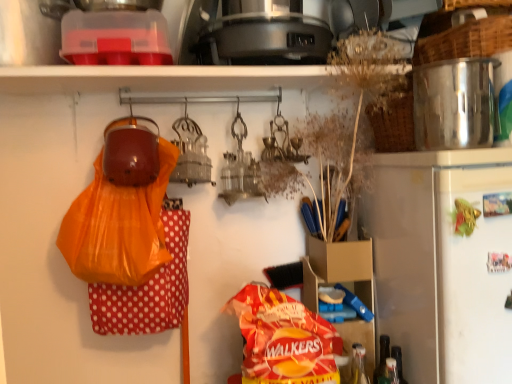
The image size is (512, 384). In order to click on satin silver refrigerator at right in this screenshot , I will do `click(442, 262)`.

This screenshot has height=384, width=512. What do you see at coordinates (466, 41) in the screenshot? I see `silver metallic pot at upper right` at bounding box center [466, 41].

I want to click on red matte bag of walkers chips at center, so click(x=283, y=339).

You are a GUI agent. You are given a task and a screenshot of the screen. Output one action in this format:
    pyautogui.click(x=<x>, y=<y>)
    Task: Click on the translucent plastic bottle at lower right, acting as the first bottle starting from the left
    
    Given the screenshot: What is the action you would take?
    pyautogui.click(x=358, y=365)

Is satin silver refrigerator at right smaller than shiny metallic pot at upper right?

No.

From the picture: Is satin silver refrigerator at right facing towards shiny metallic pot at upper right?

No, satin silver refrigerator at right is not aimed at shiny metallic pot at upper right.

Which object is wider, satin silver refrigerator at right or shiny metallic pot at upper right?

satin silver refrigerator at right is wider.

Based on the photo, considering their positions, is satin silver refrigerator at right located in front of or behind shiny metallic pot at upper right?

Visually, satin silver refrigerator at right is located behind shiny metallic pot at upper right.

Is translucent plastic bottle at lower right, placed as the second bottle when sorted from right to left, aimed at orange plastic bag at left?

No.

Is translucent plastic bottle at lower right, placed as the second bottle when sorted from right to left, far from orange plastic bag at left?

Actually, translucent plastic bottle at lower right, placed as the second bottle when sorted from right to left, and orange plastic bag at left are a little close together.

Does point (352, 362) come behind point (111, 263)?

That is True.

What's the angular difference between translucent plastic bottle at lower right, placed as the second bottle when sorted from right to left, and orange plastic bag at left's facing directions?

The angular difference between translucent plastic bottle at lower right, placed as the second bottle when sorted from right to left, and orange plastic bag at left is 2.8 degrees.

Considering the positions of point (85, 193) and point (316, 350), is point (85, 193) closer or farther from the camera than point (316, 350)?

Point (85, 193) is positioned farther from the camera compared to point (316, 350).

In terms of height, does orange plastic bag at left look taller or shorter compared to red matte bag of walkers chips at center?

orange plastic bag at left is taller than red matte bag of walkers chips at center.

From a real-world perspective, is orange plastic bag at left physically above red matte bag of walkers chips at center?

Indeed, from a real-world perspective, orange plastic bag at left stands above red matte bag of walkers chips at center.

Is orange plastic bag at left turned away from red matte bag of walkers chips at center?

orange plastic bag at left is not turned away from red matte bag of walkers chips at center.

Is the depth of translucent plastic bottle at lower right, acting as the second bottle starting from the left, greater than that of satin silver refrigerator at right?

Yes, translucent plastic bottle at lower right, acting as the second bottle starting from the left, is further from the camera.

Which of these two, translucent plastic bottle at lower right, acting as the second bottle starting from the left, or satin silver refrigerator at right, is smaller?

Smaller between the two is translucent plastic bottle at lower right, acting as the second bottle starting from the left.

From a real-world perspective, is translucent plastic bottle at lower right, the first bottle when ordered from right to left, physically located above or below satin silver refrigerator at right?

From a real-world perspective, translucent plastic bottle at lower right, the first bottle when ordered from right to left, is physically below satin silver refrigerator at right.

From a real-world perspective, between translucent plastic bottle at lower right, placed as the second bottle when sorted from right to left, and shiny metallic pot at upper right, who is vertically lower?

translucent plastic bottle at lower right, placed as the second bottle when sorted from right to left.

Considering the sizes of objects translucent plastic bottle at lower right, acting as the first bottle starting from the left, and shiny metallic pot at upper right in the image provided, who is smaller, translucent plastic bottle at lower right, acting as the first bottle starting from the left, or shiny metallic pot at upper right?

Smaller between the two is translucent plastic bottle at lower right, acting as the first bottle starting from the left.

Between translucent plastic bottle at lower right, acting as the first bottle starting from the left, and shiny metallic pot at upper right, which one appears on the right side from the viewer's perspective?

shiny metallic pot at upper right is more to the right.

Identify the location of bottle that is the 2nd object located below the shiny metallic pot at upper right (from the image's perspective). (358, 365).

Is red matte bag of walkers chips at center at the right side of silver metallic pot at upper right?

In fact, red matte bag of walkers chips at center is to the left of silver metallic pot at upper right.

Is red matte bag of walkers chips at center spatially inside silver metallic pot at upper right, or outside of it?

red matte bag of walkers chips at center is not enclosed by silver metallic pot at upper right.

This screenshot has width=512, height=384. I want to click on cereal behind the silver metallic pot at upper right, so click(x=283, y=339).

Between red matte bag of walkers chips at center and silver metallic pot at upper right, which one has larger width?

silver metallic pot at upper right.

Based on the photo, does translucent plastic bottle at lower right, acting as the first bottle starting from the left, lie in front of silver metallic pot at upper right?

No, it is behind silver metallic pot at upper right.

Is point (352, 381) farther from camera compared to point (475, 55)?

Yes, it is behind point (475, 55).

From a real-world perspective, is translucent plastic bottle at lower right, acting as the first bottle starting from the left, above or below silver metallic pot at upper right?

translucent plastic bottle at lower right, acting as the first bottle starting from the left, is below silver metallic pot at upper right.

Based on the photo, are translucent plastic bottle at lower right, placed as the second bottle when sorted from right to left, and silver metallic pot at upper right far apart?

That's not correct — translucent plastic bottle at lower right, placed as the second bottle when sorted from right to left, is a little close to silver metallic pot at upper right.

Locate an element on the screen. Image resolution: width=512 pixels, height=384 pixels. appliance located in front of the satin silver refrigerator at right is located at coordinates (455, 104).

The height and width of the screenshot is (384, 512). There is a orange plastic bag at left. Identify the location of the 2nd bottle below it (from the image's perspective). (358, 365).

Estimate the real-world distances between objects in this image. Which object is further from shiny metallic pot at upper right, satin silver refrigerator at right or orange plastic bag at left?

Answer: The object further to shiny metallic pot at upper right is orange plastic bag at left.

When comparing their distances from shiny metallic pot at upper right, does translucent plastic bottle at lower right, acting as the second bottle starting from the left, or red matte bag of walkers chips at center seem further?

translucent plastic bottle at lower right, acting as the second bottle starting from the left, is positioned further to the anchor shiny metallic pot at upper right.

Looking at the image, which one is located further to orange plastic bag at left, shiny metallic pot at upper right or translucent plastic bottle at lower right, acting as the first bottle starting from the left?

The object further to orange plastic bag at left is shiny metallic pot at upper right.

When comparing their distances from orange plastic bag at left, does satin silver refrigerator at right or red matte bag of walkers chips at center seem further?

satin silver refrigerator at right.

Estimate the real-world distances between objects in this image. Which object is closer to translucent plastic bottle at lower right, the first bottle when ordered from right to left, translucent plastic bottle at lower right, placed as the second bottle when sorted from right to left, or red matte bag of walkers chips at center?

Based on the image, translucent plastic bottle at lower right, placed as the second bottle when sorted from right to left, appears to be nearer to translucent plastic bottle at lower right, the first bottle when ordered from right to left.

From the image, which object appears to be farther from shiny metallic pot at upper right, silver metallic pot at upper right or orange plastic bag at left?

orange plastic bag at left.

Looking at the image, which one is located closer to silver metallic pot at upper right, translucent plastic bottle at lower right, acting as the second bottle starting from the left, or satin silver refrigerator at right?

satin silver refrigerator at right lies closer to silver metallic pot at upper right than the other object.

When comparing their distances from orange plastic bag at left, does silver metallic pot at upper right or shiny metallic pot at upper right seem closer?

shiny metallic pot at upper right.

The image size is (512, 384). I want to click on cereal between orange plastic bag at left and shiny metallic pot at upper right, so click(x=283, y=339).

The image size is (512, 384). I want to click on cereal between orange plastic bag at left and silver metallic pot at upper right in the horizontal direction, so click(283, 339).

Find the location of `cereal located between orange plastic bag at left and translucent plastic bottle at lower right, the first bottle when ordered from right to left, in the left-right direction`. cereal located between orange plastic bag at left and translucent plastic bottle at lower right, the first bottle when ordered from right to left, in the left-right direction is located at coordinates (283, 339).

Locate an element on the screen. Image resolution: width=512 pixels, height=384 pixels. refrigerator that lies between shiny metallic pot at upper right and red matte bag of walkers chips at center from top to bottom is located at coordinates (442, 262).